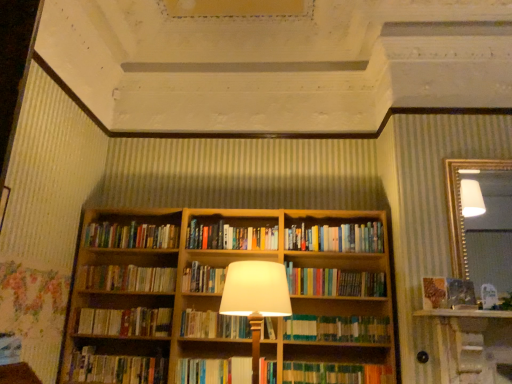
Image resolution: width=512 pixels, height=384 pixels. Describe the element at coordinates (335, 373) in the screenshot. I see `hardcover book at lower center, marked as the first book in a bottom-to-top arrangement` at that location.

Looking at this image, in order to face hardcover book at lower center, the 11th book positioned from the top, should I rotate leftwards or rightwards?

Turn right by 10.580 degrees to look at hardcover book at lower center, the 11th book positioned from the top.

The height and width of the screenshot is (384, 512). Describe the element at coordinates (125, 322) in the screenshot. I see `hardcover book at center, which is the 5th book from bottom to top` at that location.

Measure the distance between hardcover book at center, which is the 5th book from bottom to top, and camera.

10.25 feet.

The image size is (512, 384). Find the location of `gold-framed mirror at upper right`. gold-framed mirror at upper right is located at coordinates (462, 205).

What do you see at coordinates (131, 235) in the screenshot? The width and height of the screenshot is (512, 384). I see `hardcover books at center, which is the 10th book in bottom-to-top order` at bounding box center [131, 235].

Measure the distance between point (121, 227) and camera.

Point (121, 227) is 3.60 meters from camera.

This screenshot has height=384, width=512. Find the location of `hardcover book at center, acting as the second book starting from the bottom`. hardcover book at center, acting as the second book starting from the bottom is located at coordinates (215, 371).

The width and height of the screenshot is (512, 384). Find the location of `hardcover book at lower center, marked as the first book in a bottom-to-top arrangement`. hardcover book at lower center, marked as the first book in a bottom-to-top arrangement is located at coordinates (335, 373).

Considering the positions of point (423, 304) and point (326, 278), is point (423, 304) closer or farther from the camera than point (326, 278)?

Point (423, 304) is positioned closer to the camera compared to point (326, 278).

Which of these two, matte brown paper at right or multicolored books at center, acting as the fifth book starting from the top, is wider?

Wider between the two is multicolored books at center, acting as the fifth book starting from the top.

This screenshot has width=512, height=384. I want to click on the 7th book behind the matte brown paper at right, starting your count from the anchor, so click(334, 282).

From the picture: Considering the relative sizes of matte brown paper at right and multicolored books at center, acting as the fifth book starting from the top, in the image provided, is matte brown paper at right smaller than multicolored books at center, acting as the fifth book starting from the top,?

Yes, matte brown paper at right is smaller than multicolored books at center, acting as the fifth book starting from the top.

Considering the positions of objects hardcover books at center, which appears as the fourth book when viewed from the top, and hardcover books at center, positioned as the 1th book in top-to-bottom order, in the image provided, who is behind, hardcover books at center, which appears as the fourth book when viewed from the top, or hardcover books at center, positioned as the 1th book in top-to-bottom order,?

hardcover books at center, positioned as the 1th book in top-to-bottom order, is behind.

Which of these two, hardcover books at center, which appears as the fourth book when viewed from the top, or hardcover books at center, placed as the 11th book when sorted from bottom to top, is wider?

With larger width is hardcover books at center, placed as the 11th book when sorted from bottom to top.

Is hardcover books at center, which appears as the fourth book when viewed from the top, at the left side of hardcover books at center, positioned as the 1th book in top-to-bottom order?

Yes, hardcover books at center, which appears as the fourth book when viewed from the top, is to the left of hardcover books at center, positioned as the 1th book in top-to-bottom order.

Is green textured book at center, which is the 8th book in top-to-bottom order, positioned with its back to wooden bookshelf at center?

That's not correct — green textured book at center, which is the 8th book in top-to-bottom order, is not looking away from wooden bookshelf at center.

Can you confirm if green textured book at center, the 4th book in the bottom-to-top sequence, is bigger than wooden bookshelf at center?

No.

Between green textured book at center, which is the 8th book in top-to-bottom order, and wooden bookshelf at center, which one appears on the left side from the viewer's perspective?

Positioned to the left is wooden bookshelf at center.

The height and width of the screenshot is (384, 512). I want to click on table lamp on the right side of hardcover books at lower left, which ranks as the 9th book in top-to-bottom order, so click(256, 298).

Considering the points (86, 352) and (271, 269), which point is in front, point (86, 352) or point (271, 269)?

The point (271, 269) is closer.

Considering the relative sizes of hardcover books at lower left, which ranks as the 9th book in top-to-bottom order, and matte white lampshade at center in the image provided, is hardcover books at lower left, which ranks as the 9th book in top-to-bottom order, bigger than matte white lampshade at center?

Actually, hardcover books at lower left, which ranks as the 9th book in top-to-bottom order, might be smaller than matte white lampshade at center.

Relative to matte white lampshade at center, is hardcover books at lower left, which ranks as the 9th book in top-to-bottom order, in front or behind?

In the image, hardcover books at lower left, which ranks as the 9th book in top-to-bottom order, appears behind matte white lampshade at center.

Can we say hardcover book at lower center, marked as the first book in a bottom-to-top arrangement, lies outside hardcover book at center, which is the 6th book from bottom to top?

hardcover book at lower center, marked as the first book in a bottom-to-top arrangement, is positioned outside hardcover book at center, which is the 6th book from bottom to top.

Which is behind, hardcover book at lower center, the 11th book positioned from the top, or hardcover book at center, which is the 6th book from bottom to top?

hardcover book at center, which is the 6th book from bottom to top, is behind.

From the image's perspective, which one is positioned lower, hardcover book at lower center, the 11th book positioned from the top, or hardcover book at center, arranged as the sixth book when viewed from the top?

hardcover book at lower center, the 11th book positioned from the top.

Where is `book that is the 5th object above the hardcover book at lower center, the 11th book positioned from the top (from a real-world perspective)`? book that is the 5th object above the hardcover book at lower center, the 11th book positioned from the top (from a real-world perspective) is located at coordinates (213, 325).

Looking at this image, is hardcover book at lower center, marked as the first book in a bottom-to-top arrangement, inside the boundaries of green textured book at center, which is the 8th book in top-to-bottom order, or outside?

hardcover book at lower center, marked as the first book in a bottom-to-top arrangement, is not enclosed by green textured book at center, which is the 8th book in top-to-bottom order.

Considering the positions of objects hardcover book at lower center, the 11th book positioned from the top, and green textured book at center, which is the 8th book in top-to-bottom order, in the image provided, who is behind, hardcover book at lower center, the 11th book positioned from the top, or green textured book at center, which is the 8th book in top-to-bottom order,?

green textured book at center, which is the 8th book in top-to-bottom order.

Looking at this image, is hardcover book at lower center, the 11th book positioned from the top, turned away from green textured book at center, which is the 8th book in top-to-bottom order?

No, hardcover book at lower center, the 11th book positioned from the top,'s orientation is not away from green textured book at center, which is the 8th book in top-to-bottom order.

Between point (339, 366) and point (364, 338), which one is positioned behind?

The point (339, 366) is more distant.

Is hardcover books at center, which is the 10th book in bottom-to-top order, situated inside wooden bookshelf at center or outside?

The correct answer is: outside.

Does hardcover books at center, which is the 10th book in bottom-to-top order, come in front of wooden bookshelf at center?

No, the depth of hardcover books at center, which is the 10th book in bottom-to-top order, is greater than that of wooden bookshelf at center.

From the image's perspective, which one is positioned lower, hardcover books at center, which is the 10th book in bottom-to-top order, or wooden bookshelf at center?

wooden bookshelf at center appears lower in the image.

There is a matte brown paper at right. At what (x,y) coordinates should I click in order to perform the action: click on the 2nd book below it (from the image's perspective). Please return your answer as a coordinate pair (x, y). The image size is (512, 384). Looking at the image, I should click on (334, 282).

Where is `the 1st book behind the hardcover books at center, which appears as the eighth book when ordered from the bottom`? the 1st book behind the hardcover books at center, which appears as the eighth book when ordered from the bottom is located at coordinates (231, 237).

Which object lies further to the anchor point hardcover book at center, the 7th book positioned from the top, green textured book at center, the 4th book in the bottom-to-top sequence, or hardcover book at center, which ranks as the 10th book in top-to-bottom order?

Based on the image, green textured book at center, the 4th book in the bottom-to-top sequence, appears to be further to hardcover book at center, the 7th book positioned from the top.

Considering their positions, is hardcover books at lower left, which ranks as the 9th book in top-to-bottom order, positioned closer to wooden bookshelf at center than matte brown paper at right?

The object closer to wooden bookshelf at center is hardcover books at lower left, which ranks as the 9th book in top-to-bottom order.

Considering their positions, is hardcover book at center, acting as the second book starting from the bottom, positioned closer to multicolored books at center, which is counted as the seventh book, starting from the bottom, than hardcover books at center, placed as the 11th book when sorted from bottom to top?

hardcover books at center, placed as the 11th book when sorted from bottom to top, lies closer to multicolored books at center, which is counted as the seventh book, starting from the bottom, than the other object.

In the scene shown: Looking at the image, which one is located closer to wooden bookshelf at center, hardcover books at center, positioned as the 1th book in top-to-bottom order, or hardcover book at center, which ranks as the 10th book in top-to-bottom order?

hardcover books at center, positioned as the 1th book in top-to-bottom order, lies closer to wooden bookshelf at center than the other object.

From the image, which object appears to be farther from matte brown paper at right, wooden bookshelf at center or multicolored books at center, which is counted as the seventh book, starting from the bottom?

Based on the image, wooden bookshelf at center appears to be further to matte brown paper at right.

Based on their spatial positions, is hardcover book at center, which is the 6th book from bottom to top, or multicolored books at center, acting as the fifth book starting from the top, further from matte brown paper at right?

Among the two, hardcover book at center, which is the 6th book from bottom to top, is located further to matte brown paper at right.

Which object lies nearer to the anchor point hardcover book at lower center, the 11th book positioned from the top, wooden bookcase at center or matte brown paper at right?

wooden bookcase at center is closer to hardcover book at lower center, the 11th book positioned from the top.

Based on their spatial positions, is wooden bookcase at center or hardcover books at center, which is the 10th book in bottom-to-top order, further from hardcover books at lower left, the 3th book from the bottom?

hardcover books at center, which is the 10th book in bottom-to-top order.

Locate an element on the screen. The height and width of the screenshot is (384, 512). paperback book situated between hardcover books at center, which is the 10th book in bottom-to-top order, and gold-framed mirror at upper right from left to right is located at coordinates (434, 292).

Find the location of `bookcase situated between hardcover book at center, which ranks as the 10th book in top-to-bottom order, and green textured book at center, which is the 8th book in top-to-bottom order, from left to right`. bookcase situated between hardcover book at center, which ranks as the 10th book in top-to-bottom order, and green textured book at center, which is the 8th book in top-to-bottom order, from left to right is located at coordinates (220, 301).

Where is `table lamp between hardcover books at center, the 2th book from the top, and green textured book at center, which is the 8th book in top-to-bottom order, from left to right`? The height and width of the screenshot is (384, 512). table lamp between hardcover books at center, the 2th book from the top, and green textured book at center, which is the 8th book in top-to-bottom order, from left to right is located at coordinates (256, 298).

The height and width of the screenshot is (384, 512). In order to click on bookcase between matte white lampshade at center and multicolored books at center, acting as the fifth book starting from the top, from front to back in this screenshot , I will do `click(220, 301)`.